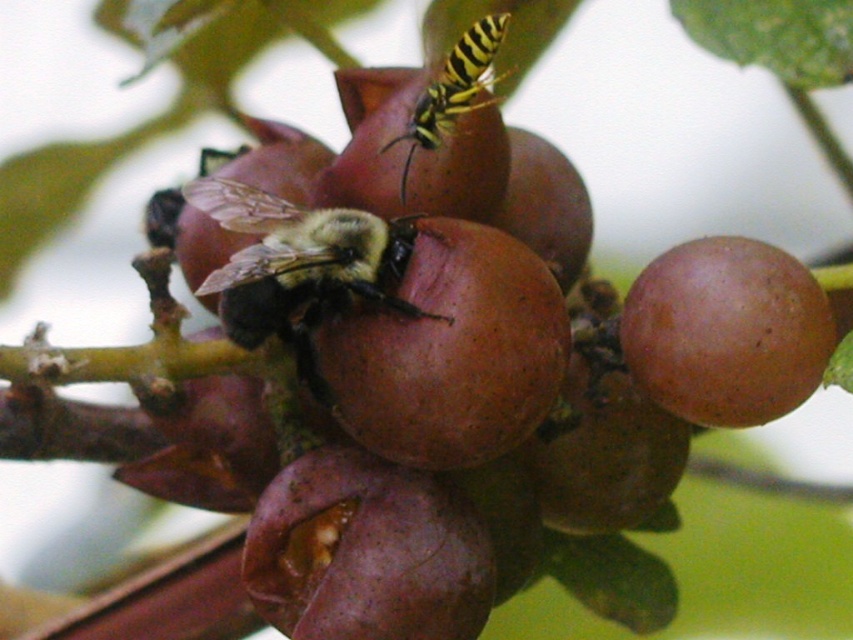
Identify the location of brown matte fruit at center. The width and height of the screenshot is (853, 640). (450, 353).

In the scene shown: Is brown matte fruit at center to the left of purple matte grape at center from the viewer's perspective?

No, brown matte fruit at center is not to the left of purple matte grape at center.

Between point (456, 256) and point (265, 563), which one is positioned in front?

Point (456, 256)

Where is `brown matte fruit at center`? The image size is (853, 640). brown matte fruit at center is located at coordinates (450, 353).

Who is higher up, brown matte fruit at center or yellow-black striped wasp at upper center?

Positioned higher is yellow-black striped wasp at upper center.

Is brown matte fruit at center taller than yellow-black striped wasp at upper center?

No.

Does point (450, 323) come closer to viewer compared to point (408, 172)?

Yes.

The height and width of the screenshot is (640, 853). In order to click on brown matte fruit at center in this screenshot , I will do `click(450, 353)`.

Who is taller, black fuzzy bee at center or yellow-black striped wasp at upper center?

yellow-black striped wasp at upper center is taller.

Who is higher up, black fuzzy bee at center or yellow-black striped wasp at upper center?

yellow-black striped wasp at upper center

Is point (374, 273) positioned after point (451, 61)?

That is False.

Identify the location of black fuzzy bee at center. Image resolution: width=853 pixels, height=640 pixels. (299, 260).